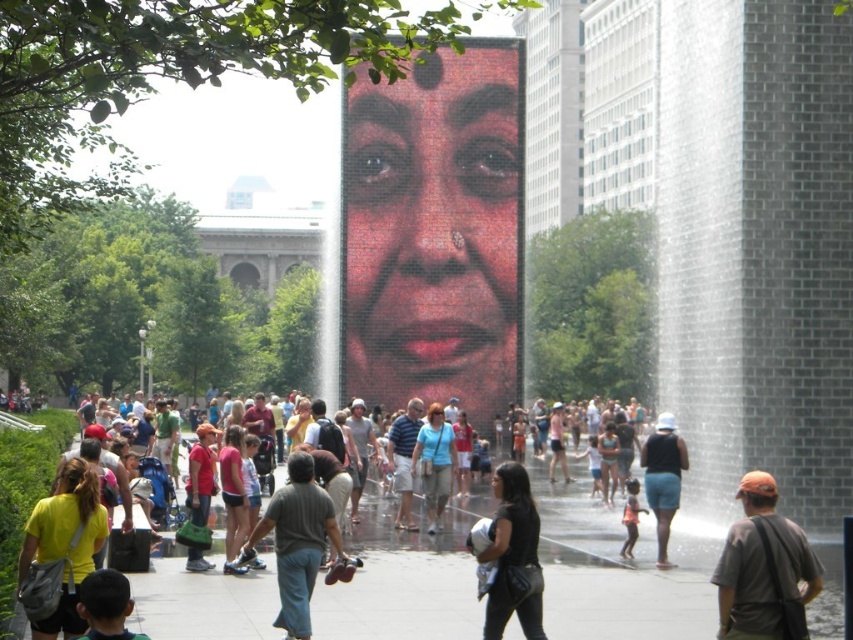
Question: Which point is farther from the camera taking this photo?

Choices:
 (A) (630, 554)
 (B) (280, 531)

Answer: (A)

Question: Is black leather bag at center closer to the viewer compared to orange cotton shirt at center?

Choices:
 (A) no
 (B) yes

Answer: (B)

Question: Which of the following is the closest to the observer?

Choices:
 (A) dark brown hair at lower left
 (B) orange cap at center
 (C) matte red face at center
 (D) black leather bag at center

Answer: (A)

Question: Does orange cap at center have a smaller size compared to matte blue shirt at center?

Choices:
 (A) yes
 (B) no

Answer: (B)

Question: Is orange cap at center above black leather bag at center?

Choices:
 (A) no
 (B) yes

Answer: (A)

Question: Which is nearer to the matte blue shirt at center?

Choices:
 (A) orange cotton shirt at center
 (B) dark brown hair at lower left
 (C) matte black tank top at center

Answer: (A)